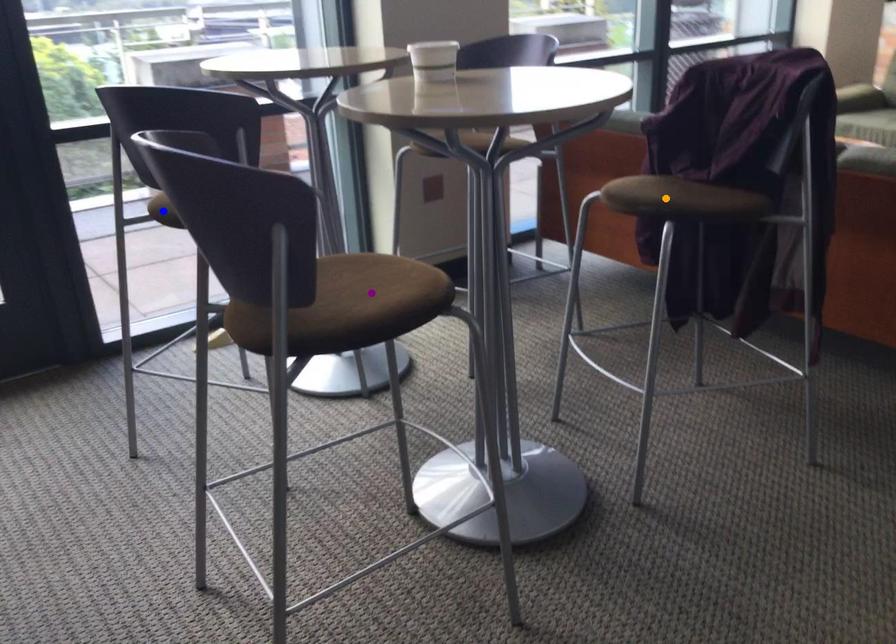
Order these from nearest to farthest:
purple point, orange point, blue point

purple point < orange point < blue point